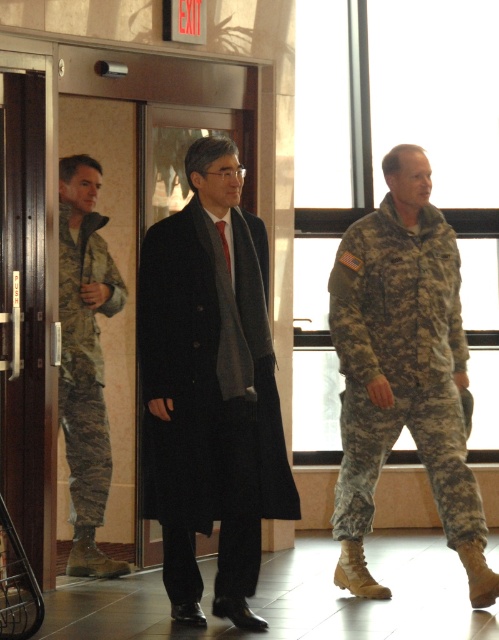
Who is more distant from viewer, [169,250] or [104,220]?

The point [104,220] is more distant.

Does black wool coat at center have a lesser width compared to camouflage uniform at left?

No, black wool coat at center is not thinner than camouflage uniform at left.

Who is more forward, (256,529) or (84,356)?

Point (256,529) is more forward.

I want to click on black wool coat at center, so click(x=211, y=388).

Is point (264, 468) behind point (424, 296)?

No, (264, 468) is closer to viewer.

Is black wool coat at center smaller than camouflage uniform at right?

Yes.

The width and height of the screenshot is (499, 640). In order to click on black wool coat at center in this screenshot , I will do `click(211, 388)`.

You are a GUI agent. You are given a task and a screenshot of the screen. Output one action in this format:
    pyautogui.click(x=<x>, y=<y>)
    Task: Click on the black wool coat at center
    
    Given the screenshot: What is the action you would take?
    pyautogui.click(x=211, y=388)

Does camouflage uniform at right appear over camouflage uniform at left?

No.

Is the position of camouflage uniform at right less distant than that of camouflage uniform at left?

Yes, it is in front of camouflage uniform at left.

At what (x,y) coordinates should I click in order to perform the action: click on camouflage uniform at right. Please return your answer as a coordinate pair (x, y). This screenshot has height=640, width=499. Looking at the image, I should click on [403, 371].